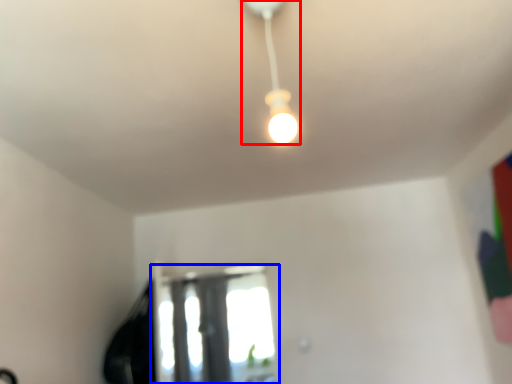
Question: Which of the following is the farthest to the observer, lamp (highlighted by a red box) or window (highlighted by a blue box)?

Choices:
 (A) lamp
 (B) window

Answer: (B)